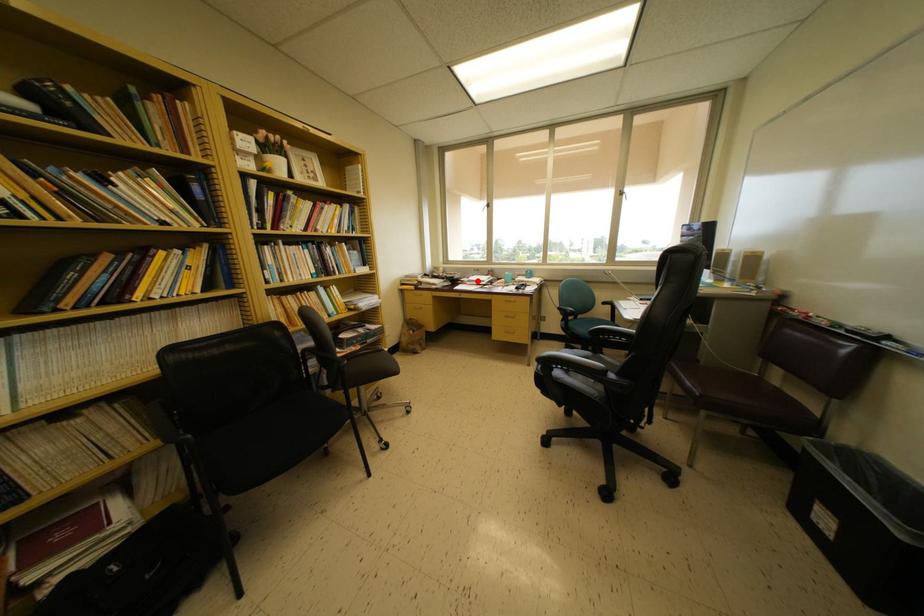
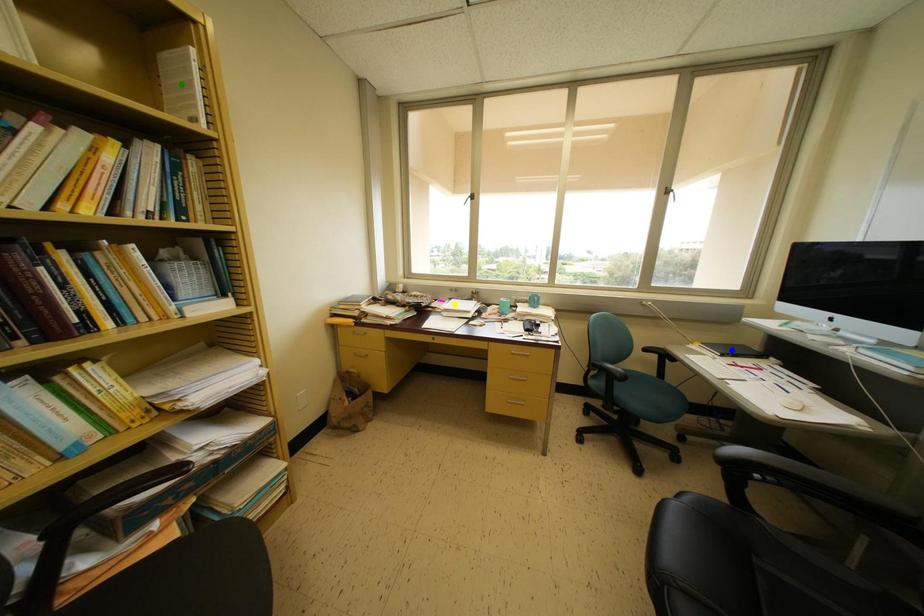
Question: I am providing you with two images of the same scene from different viewpoints. A red point is marked on the first image. You are given multiple points on the second image. Can you choose the point in image 2 that corresponds to the point in image 1?

Choices:
 (A) blue point
 (B) green point
 (C) yellow point

Answer: (C)